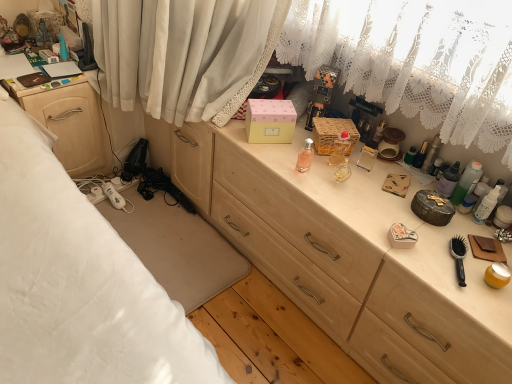
Locate an element on the screen. vacant region to the left of translucent plastic bottles at right, the second toiletry when ordered from right to left is located at coordinates (415, 187).